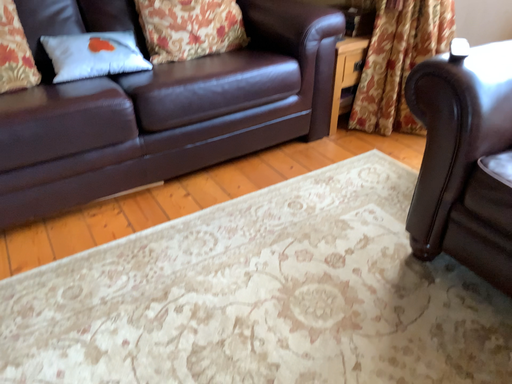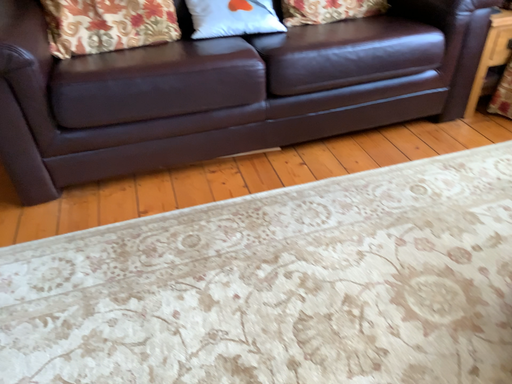
Question: How did the camera likely rotate when shooting the video?

Choices:
 (A) rotated right
 (B) rotated left

Answer: (B)